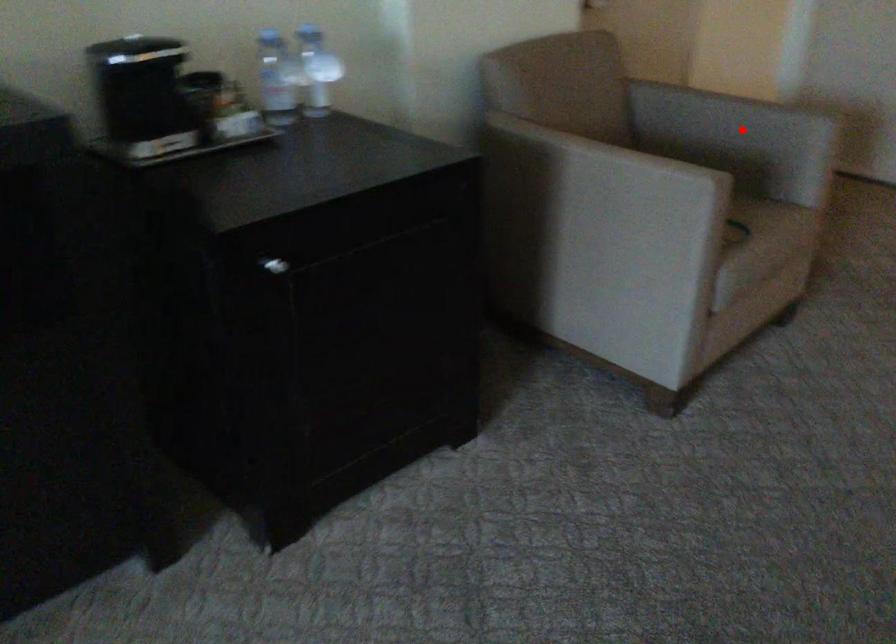
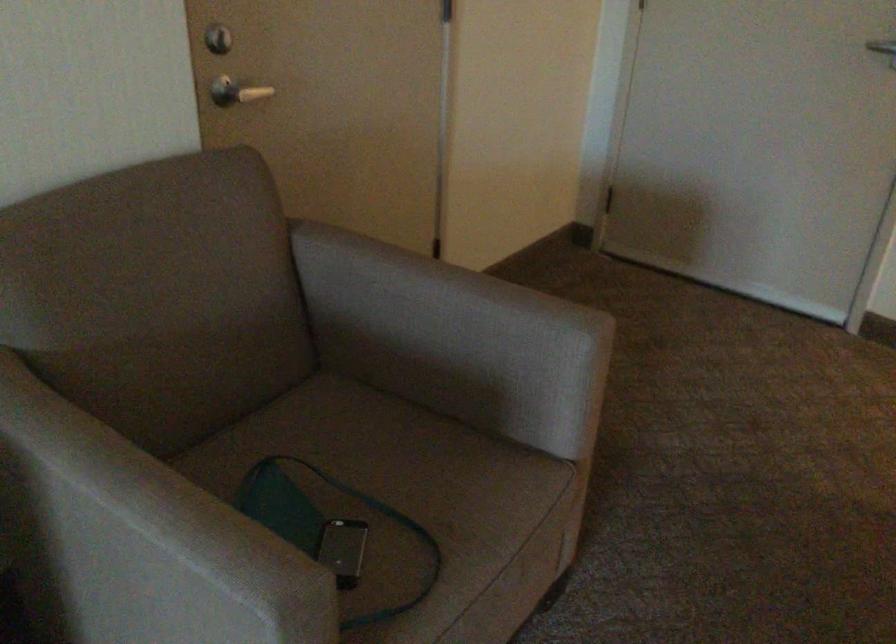
Question: I am providing you with two images of the same scene from different viewpoints. A red point is marked on the first image. At the location where the point appears in image 1, is it still visible in image 2?

Choices:
 (A) Yes
 (B) No

Answer: (A)